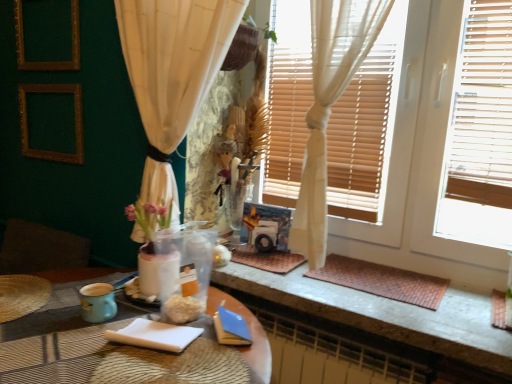
What are the coordinates of `vacant space to the right of teal ceramic mug at lower left` in the screenshot? It's located at (145, 309).